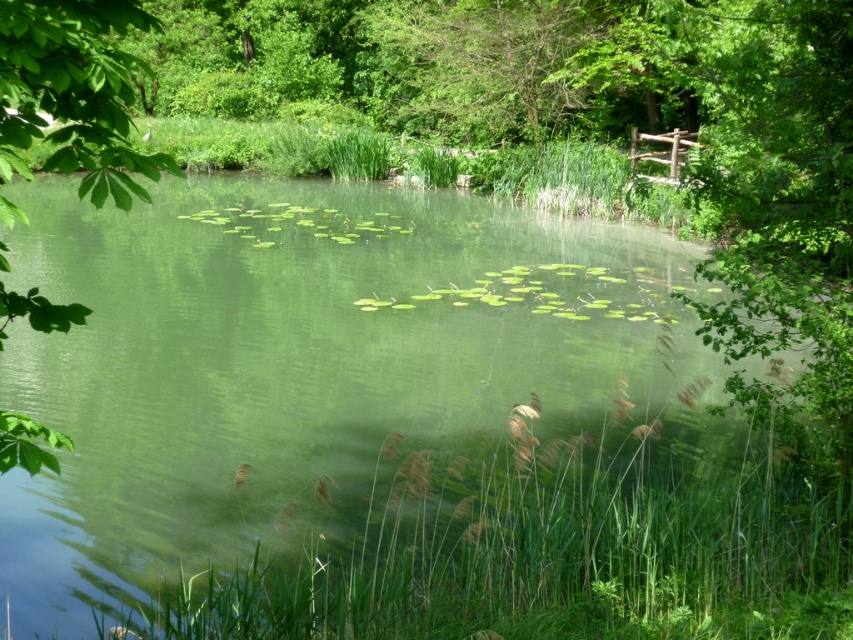
Is point (496, 294) less distant than point (6, 141)?

No, it is behind (6, 141).

Who is higher up, green translucent water at center or green leafy tree at left?

green translucent water at center is above.

Is point (3, 365) closer to camera compared to point (68, 42)?

No, (3, 365) is further to viewer.

Where is `green translucent water at center`? This screenshot has height=640, width=853. green translucent water at center is located at coordinates (389, 428).